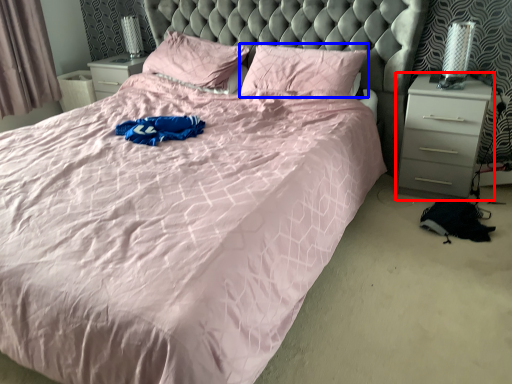
Question: Among these objects, which one is farthest to the camera, nightstand (highlighted by a red box) or pillow (highlighted by a blue box)?

Choices:
 (A) nightstand
 (B) pillow

Answer: (B)